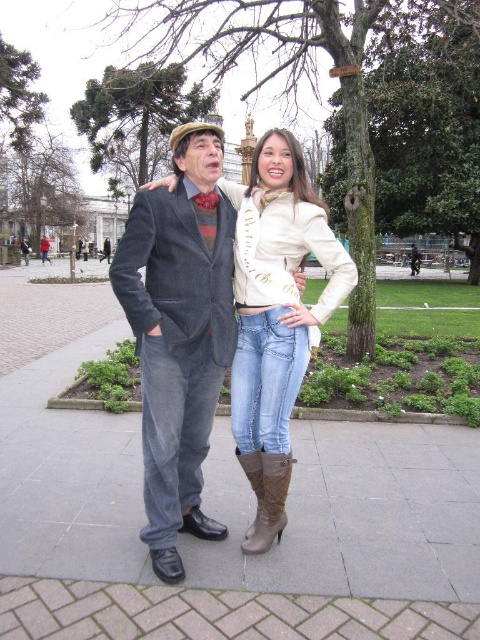
You are a photographer setting up a shoot in the park. You have two props to place in the scene, a denim jeans at center and a light beige leather jacket at center. Based on their sizes, which prop should you choose to emphasize a sense of scale in your composition?

The denim jeans at center is larger in size than the light beige leather jacket at center, so choosing the denim jeans at center would better emphasize a sense of scale in your composition.

You are a tailor who needs to determine if the light beige leather jacket at center can fit through a narrow doorway that the brown suede boot at lower center is currently blocking. Can the jacket pass through without removing the boot?

The light beige leather jacket at center is wider than the brown suede boot at lower center, so it might not fit through the doorway if the boot is blocking the path. The tailor should consider moving the boot first to ensure there is enough space.

You are standing in the park and see two points marked in the image. Which point is closer to you, point (269, 248) or point (276, 460)?

Point (269, 248) is closer to you because it is further to the viewer than point (276, 460).